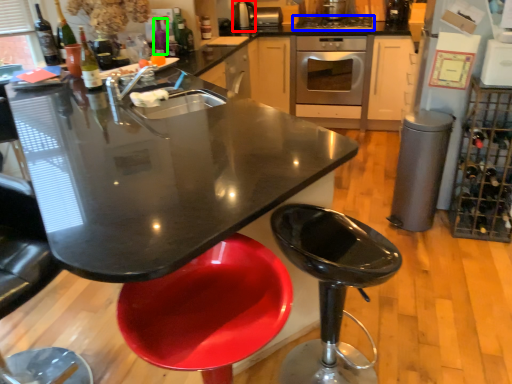
Question: Based on their relative distances, which object is nearer to appliance (highlighted by a red box)? Choose from kitchen appliance (highlighted by a blue box) and bottle (highlighted by a green box).

Choices:
 (A) kitchen appliance
 (B) bottle

Answer: (A)